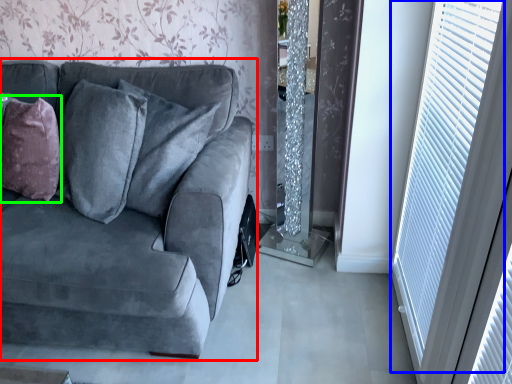
Question: Considering the real-world distances, which object is closest to studio couch (highlighted by a red box)? window (highlighted by a blue box) or throw pillow (highlighted by a green box).

Choices:
 (A) window
 (B) throw pillow

Answer: (B)